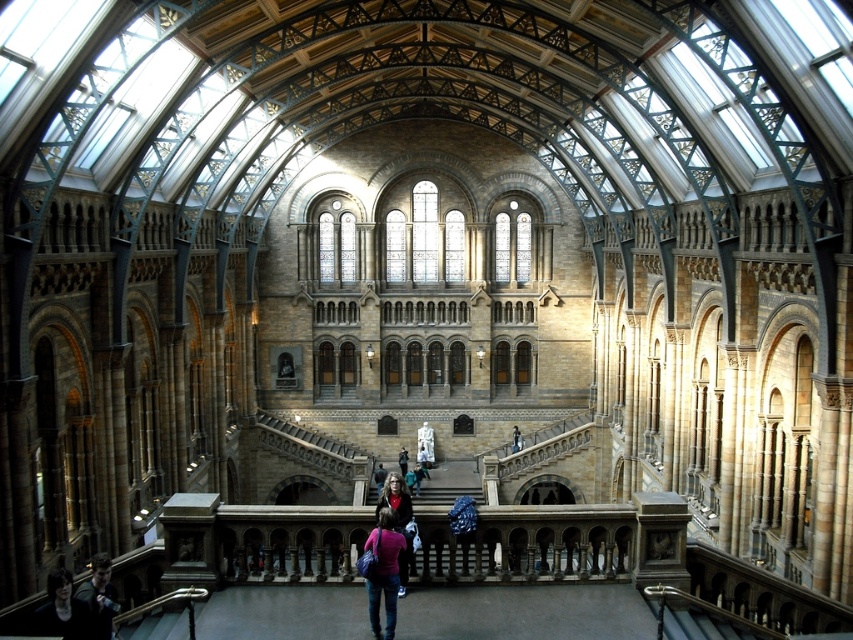
Question: Which point appears closest to the camera in this image?

Choices:
 (A) (427, 468)
 (B) (392, 568)
 (C) (409, 512)

Answer: (B)

Question: Which object is the farthest from the matte white statue at center?

Choices:
 (A) matte purple sweater at center
 (B) dark blue jeans at lower left
 (C) dark brown leather jacket at center

Answer: (A)

Question: Is dark brown hair at center positioned behind matte white statue at center?

Choices:
 (A) no
 (B) yes

Answer: (A)

Question: Which point is farther to the camera?

Choices:
 (A) (421, 465)
 (B) (96, 624)

Answer: (A)

Question: Can you confirm if dark blue jeans at lower left is positioned below matte white statue at center?

Choices:
 (A) yes
 (B) no

Answer: (B)

Question: Is dark brown leather jacket at center thinner than matte white statue at center?

Choices:
 (A) yes
 (B) no

Answer: (B)